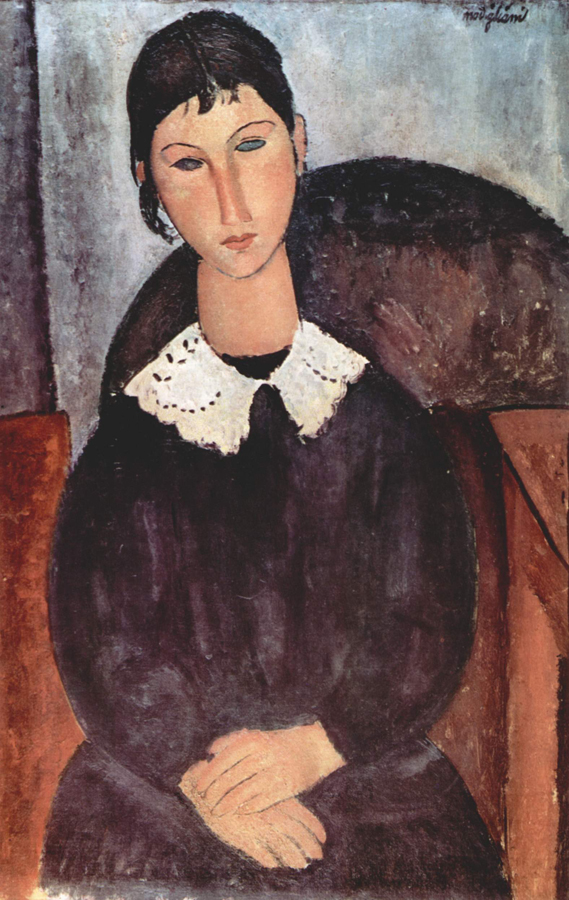
Where is `corner`? corner is located at coordinates (39, 162).